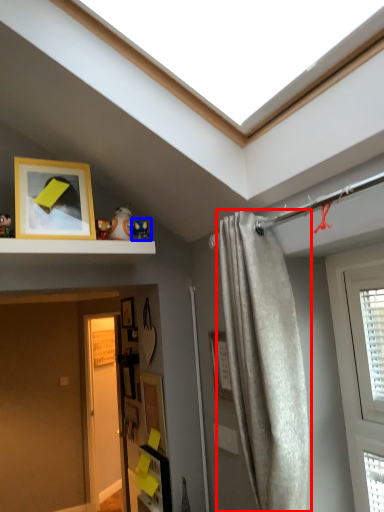
Question: Among these objects, which one is nearest to the camera, curtain (highlighted by a red box) or toy (highlighted by a blue box)?

Choices:
 (A) curtain
 (B) toy

Answer: (A)